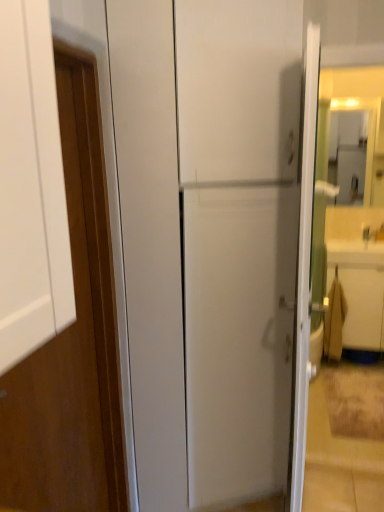
Question: Can you confirm if beige fabric drawer at right is shorter than wooden door at left?

Choices:
 (A) yes
 (B) no

Answer: (A)

Question: Can you confirm if beige fabric drawer at right is taller than wooden door at left?

Choices:
 (A) no
 (B) yes

Answer: (A)

Question: Is beige fabric drawer at right aimed at wooden door at left?

Choices:
 (A) yes
 (B) no

Answer: (B)

Question: Is beige fabric drawer at right surrounding wooden door at left?

Choices:
 (A) no
 (B) yes

Answer: (A)

Question: Does beige fabric drawer at right appear on the left side of wooden door at left?

Choices:
 (A) no
 (B) yes

Answer: (A)

Question: Is beige fabric drawer at right bigger than wooden door at left?

Choices:
 (A) yes
 (B) no

Answer: (A)

Question: From a real-world perspective, is wooden door at left under beige fabric drawer at right?

Choices:
 (A) yes
 (B) no

Answer: (B)

Question: Can you confirm if wooden door at left is positioned to the left of beige fabric drawer at right?

Choices:
 (A) no
 (B) yes

Answer: (B)

Question: Could you tell me if wooden door at left is facing beige fabric drawer at right?

Choices:
 (A) no
 (B) yes

Answer: (A)

Question: Is wooden door at left not within beige fabric drawer at right?

Choices:
 (A) yes
 (B) no

Answer: (A)

Question: Is wooden door at left positioned with its back to beige fabric drawer at right?

Choices:
 (A) yes
 (B) no

Answer: (B)

Question: Is beige fabric drawer at right completely or partially inside wooden door at left?

Choices:
 (A) no
 (B) yes

Answer: (A)

Question: From the image's perspective, is beige fabric drawer at right located above or below wooden door at left?

Choices:
 (A) below
 (B) above

Answer: (A)